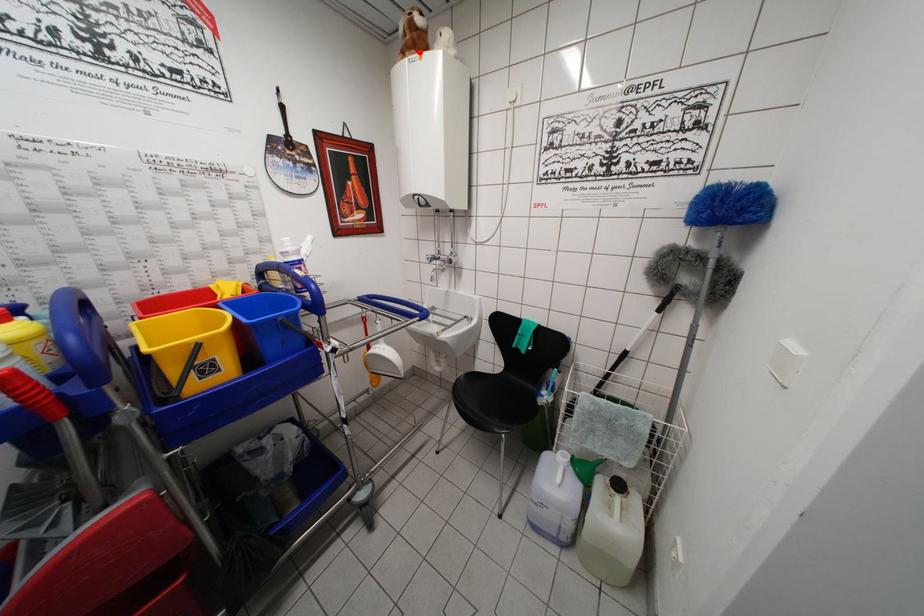
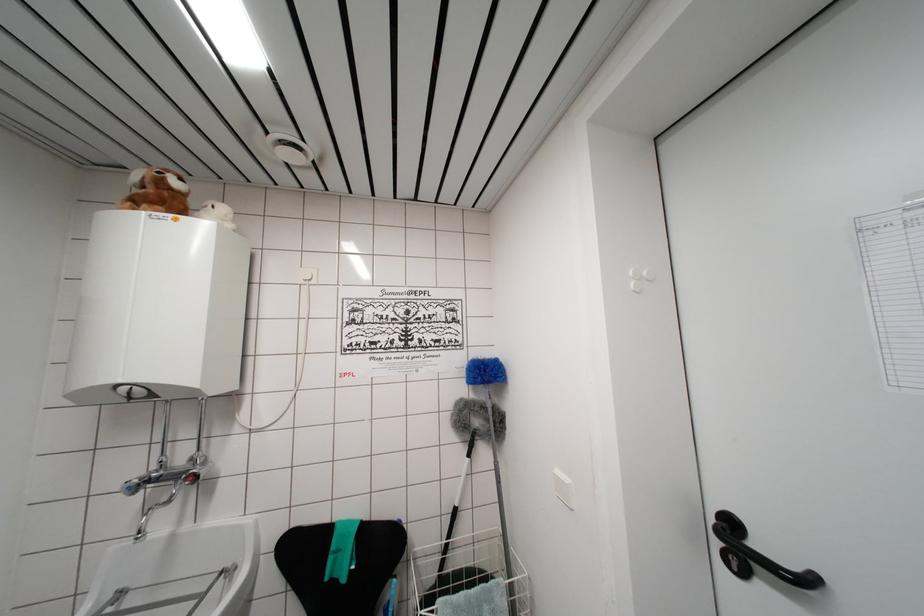
In the second image, find the point that corresponds to the highlighted location in the first image.

(168, 209)